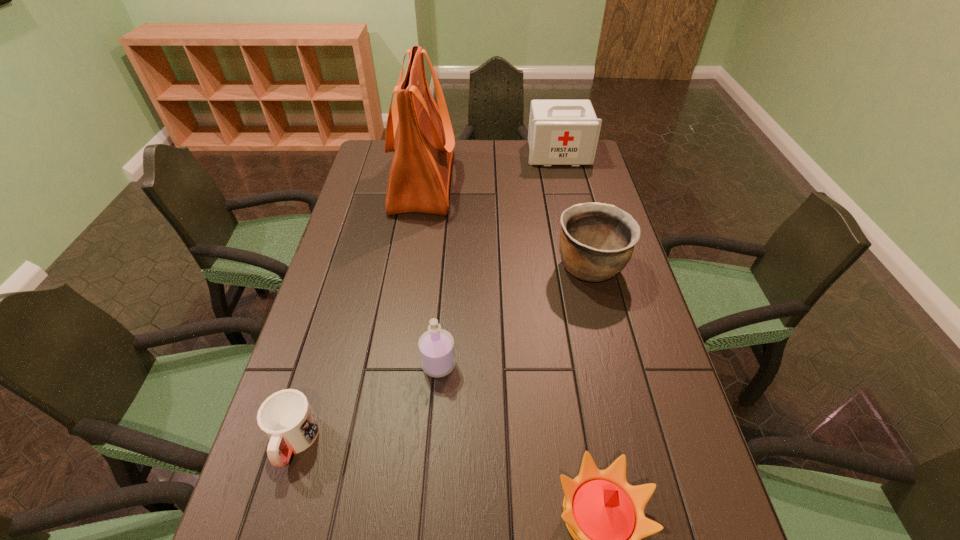
Where is `object that is the closest to the perfume`? The height and width of the screenshot is (540, 960). object that is the closest to the perfume is located at coordinates (286, 417).

Where is `vacant space that satisfies the following two spatial constraints: 1. on the front-facing side of the first-aid kit; 2. on the left side of the pottery`? This screenshot has height=540, width=960. vacant space that satisfies the following two spatial constraints: 1. on the front-facing side of the first-aid kit; 2. on the left side of the pottery is located at coordinates (585, 267).